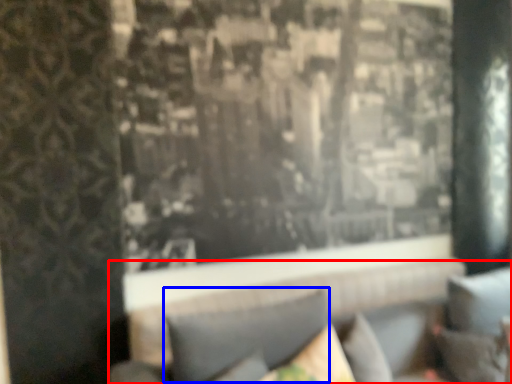
Question: Among these objects, which one is farthest to the camera, couch (highlighted by a red box) or pillow (highlighted by a blue box)?

Choices:
 (A) couch
 (B) pillow

Answer: (B)